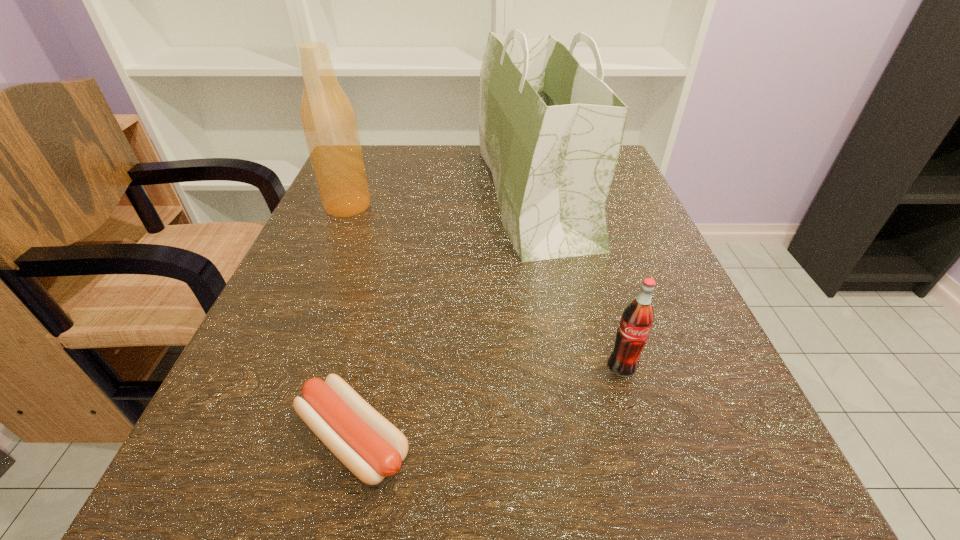
Where is `grocery bag`? grocery bag is located at coordinates (550, 131).

Identify the location of the leftmost object. (328, 119).

You are a GUI agent. You are given a task and a screenshot of the screen. Output one action in this format:
    pyautogui.click(x=<x>, y=<y>)
    Task: Click on the second shortest object
    This screenshot has height=540, width=960.
    Given the screenshot: What is the action you would take?
    pyautogui.click(x=637, y=319)

Where is `soda bottle`? soda bottle is located at coordinates (637, 319).

This screenshot has width=960, height=540. I want to click on the shortest object, so click(x=371, y=447).

This screenshot has width=960, height=540. I want to click on the nearest object, so click(371, 447).

This screenshot has width=960, height=540. I want to click on vacant space situated on the left of the grocery bag, so click(x=358, y=194).

Locate an element on the screen. Image resolution: width=960 pixels, height=540 pixels. vacant region located on the front of the beer bottle is located at coordinates (307, 302).

The image size is (960, 540). In order to click on vacant space located 0.060m on the label of the second nearest object in this screenshot , I will do `click(637, 420)`.

You are a GUI agent. You are given a task and a screenshot of the screen. Output one action in this format:
    pyautogui.click(x=<x>, y=<y>)
    Task: Click on the free region located 0.050m on the right of the sausage
    This screenshot has width=960, height=540.
    Given the screenshot: What is the action you would take?
    pyautogui.click(x=457, y=439)